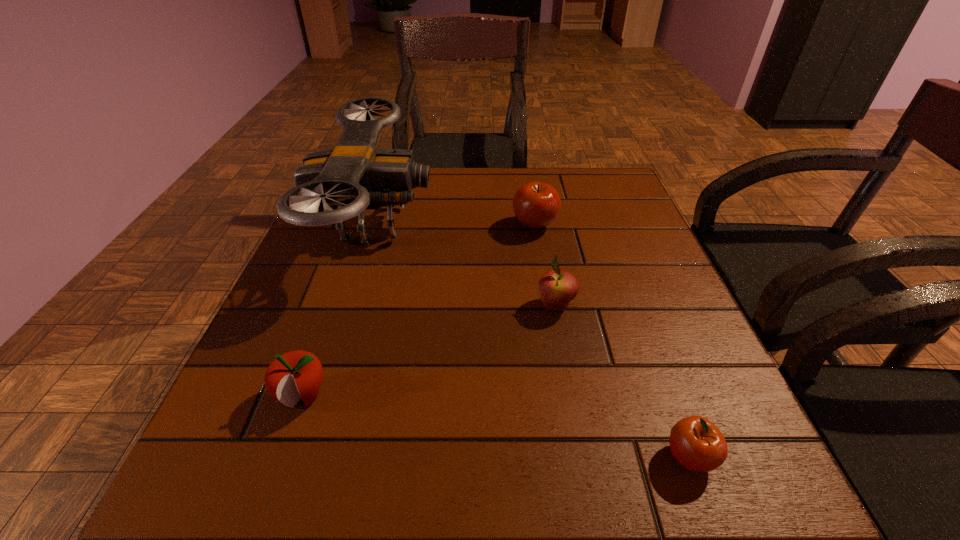
Identify the location of vacant area that lies between the second nearest apple and the rightmost object. 496,427.

Where is `empty space that is in between the farthest apple and the second farthest apple`? This screenshot has height=540, width=960. empty space that is in between the farthest apple and the second farthest apple is located at coordinates (545, 266).

Find the location of `vacant space that's between the leftmost apple and the farthest apple`. vacant space that's between the leftmost apple and the farthest apple is located at coordinates (419, 310).

Locate an element on the screen. Image resolution: width=960 pixels, height=540 pixels. empty space between the third farthest apple and the third nearest apple is located at coordinates (429, 350).

Locate an element on the screen. free space between the nearest object and the farthest apple is located at coordinates (612, 341).

Locate an element on the screen. This screenshot has width=960, height=540. vacant region between the nearest object and the second farthest apple is located at coordinates (622, 381).

Choose which object is the fourth nearest neighbor to the drone. Please provide its 2D coordinates. Your answer should be formatted as a tuple, i.e. [(x, y)], where the tuple contains the x and y coordinates of a point satisfying the conditions above.

[(696, 443)]

Identify the location of object that is the fourth closest to the third nearest apple. (295, 375).

Where is `the second closest apple to the farthest apple`? This screenshot has height=540, width=960. the second closest apple to the farthest apple is located at coordinates (696, 443).

Where is `the third closest apple to the nearest apple`? This screenshot has width=960, height=540. the third closest apple to the nearest apple is located at coordinates (295, 375).